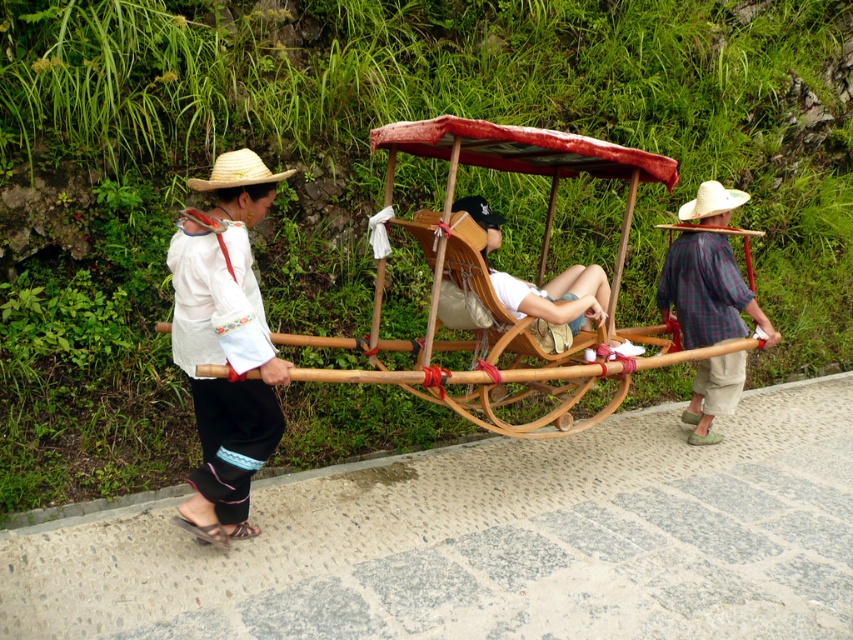
Consider the image. You are a photographer planning to take a photo of the wooden bamboo cart at center and the strawtexturehat at left. If you want to ensure both objects are clearly visible in the frame, which one should you focus on first?

The wooden bamboo cart at center is larger in size than the strawtexturehat at left, so you should focus on the wooden bamboo cart at center first to ensure it is clearly visible.

You are a traveler wanting to move from the bamboo cart at center to the plaid fabric cart at right. Can you walk directly between them without needing to go around?

The bamboo cart at center and plaid fabric cart at right are 3.43 feet apart, so yes, you can walk directly between them since the distance is sufficient for a person to pass through.